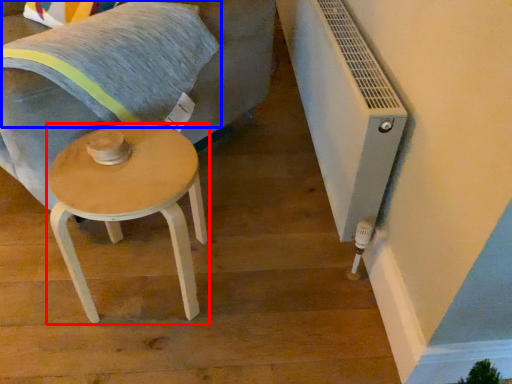
Question: Which point is further to the camera, stool (highlighted by a red box) or pillow (highlighted by a blue box)?

Choices:
 (A) stool
 (B) pillow

Answer: (B)